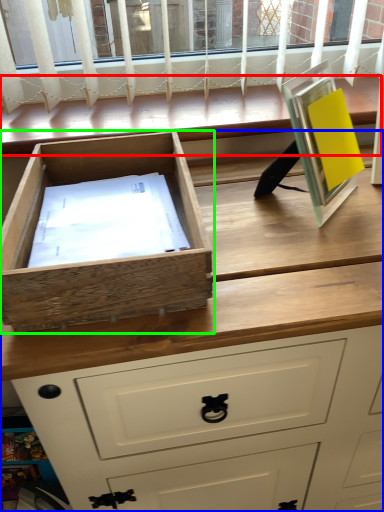
Question: Which object is the closest to the window (highlighted by a red box)? Choose among these: chest of drawers (highlighted by a blue box) or drawer (highlighted by a green box).

Choices:
 (A) chest of drawers
 (B) drawer

Answer: (B)